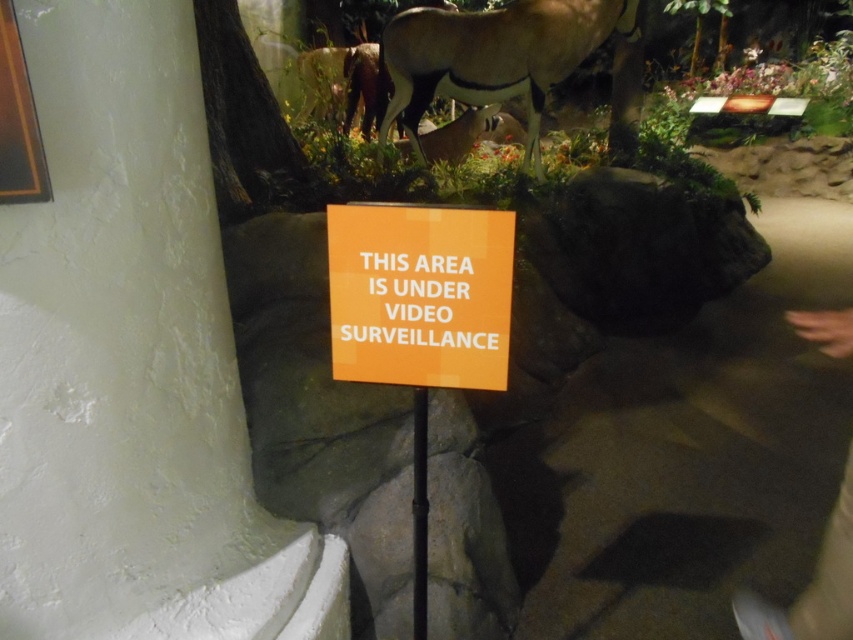
Question: Does light brown glossy antelope at center appear over brown fur antelope at center?

Choices:
 (A) no
 (B) yes

Answer: (B)

Question: Which of the following is the farthest from the observer?

Choices:
 (A) orange matte sign at center
 (B) dark gray pants at lower right
 (C) brown fur antelope at center

Answer: (C)

Question: In this image, where is light brown glossy antelope at center located relative to dark gray pants at lower right?

Choices:
 (A) above
 (B) below

Answer: (A)

Question: Estimate the real-world distances between objects in this image. Which object is farther from the light brown glossy antelope at center?

Choices:
 (A) dark gray pants at lower right
 (B) orange matte sign at center

Answer: (B)

Question: Is orange matte sign at center positioned behind dark gray pants at lower right?

Choices:
 (A) yes
 (B) no

Answer: (B)

Question: Which of the following is the farthest from the observer?

Choices:
 (A) light brown glossy antelope at center
 (B) orange matte sign at center
 (C) brown fur antelope at center

Answer: (C)